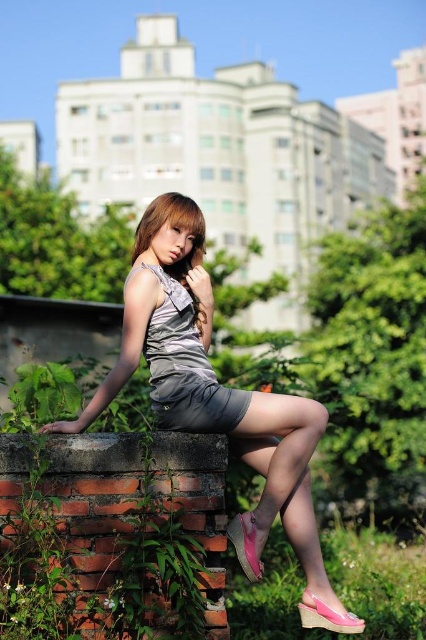
Does satin dress at center appear on the left side of satin silver dress at center?

In fact, satin dress at center is to the right of satin silver dress at center.

Is satin dress at center below satin silver dress at center?

Correct, satin dress at center is located below satin silver dress at center.

Locate an element on the screen. The image size is (426, 640). satin dress at center is located at coordinates (184, 368).

Locate an element on the screen. satin dress at center is located at coordinates (184, 368).

Between point (46, 428) and point (149, 346), which one is positioned in front?

Point (46, 428) is in front.

Which is behind, point (238, 518) or point (175, 408)?

Positioned behind is point (238, 518).

The width and height of the screenshot is (426, 640). In order to click on satin gray dress at center in this screenshot , I will do `click(221, 416)`.

Is point (207, 371) closer to viewer compared to point (198, 208)?

Yes, point (207, 371) is closer to viewer.

Who is positioned more to the left, satin gray dress at center or satin silver dress at center?

Positioned to the left is satin silver dress at center.

Describe the element at coordinates (221, 416) in the screenshot. I see `satin gray dress at center` at that location.

This screenshot has height=640, width=426. I want to click on satin gray dress at center, so click(x=221, y=416).